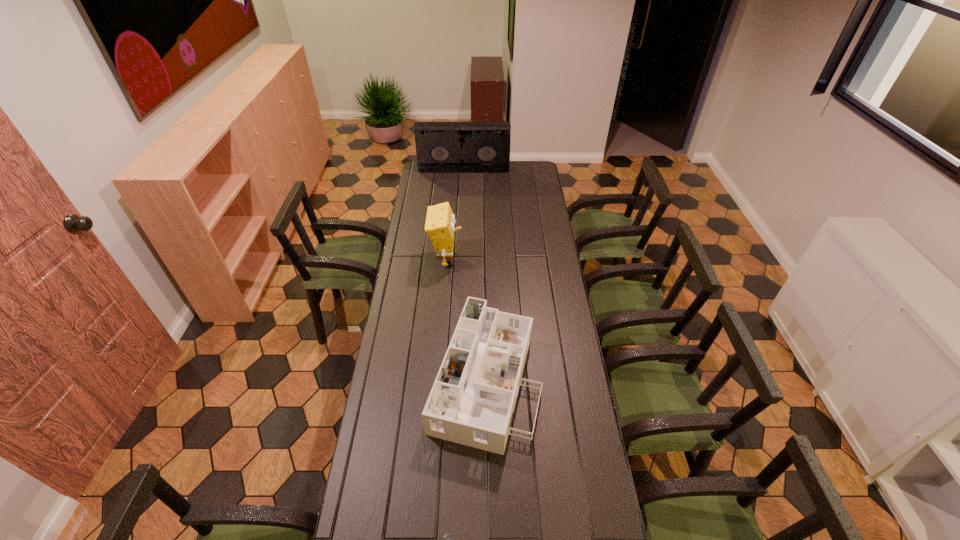
Identify the location of object that is at the right edge. Image resolution: width=960 pixels, height=540 pixels. (473, 397).

You are a GUI agent. You are given a task and a screenshot of the screen. Output one action in this format:
    pyautogui.click(x=<x>, y=<y>)
    Task: Click on the object located in the far left corner section of the desktop
    
    Given the screenshot: What is the action you would take?
    pyautogui.click(x=441, y=147)

At what (x,y) coordinates should I click in order to perform the action: click on free location at the far edge. Please return your answer as a coordinate pair (x, y). Looking at the image, I should click on (468, 180).

Locate an element on the screen. This screenshot has width=960, height=540. free location at the left edge is located at coordinates (359, 478).

The image size is (960, 540). Find the location of `vacant space at the right edge of the desktop`. vacant space at the right edge of the desktop is located at coordinates (550, 341).

Identify the location of vacant space at the far right corner of the desktop. Image resolution: width=960 pixels, height=540 pixels. (524, 162).

Image resolution: width=960 pixels, height=540 pixels. I want to click on empty location between the dollhouse and the videotape, so click(x=474, y=274).

Where is `free space between the second farthest object and the videotape`? free space between the second farthest object and the videotape is located at coordinates (455, 215).

Locate an element on the screen. This screenshot has width=960, height=540. vacant region between the dollhouse and the videotape is located at coordinates (474, 274).

Identify which object is the third nearest to the shortest object. Please provide its 2D coordinates. Your answer should be formatted as a tuple, i.e. [(x, y)], where the tuple contains the x and y coordinates of a point satisfying the conditions above.

[(441, 147)]